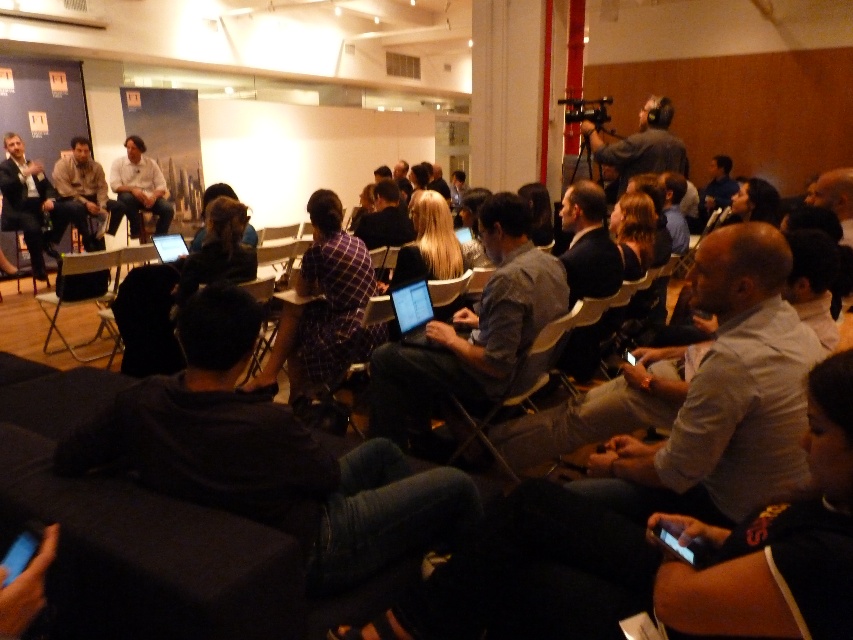
Is plaid fabric dress at center to the right of matte black suit at left from the viewer's perspective?

Yes, plaid fabric dress at center is to the right of matte black suit at left.

Is point (323, 227) farther from viewer compared to point (28, 230)?

No, (323, 227) is closer to viewer.

Where is `plaid fabric dress at center`? plaid fabric dress at center is located at coordinates (323, 307).

Which of these two, plaid fabric dress at center or black plastic chair at left, stands taller?

Standing taller between the two is plaid fabric dress at center.

Can you confirm if plaid fabric dress at center is thinner than black plastic chair at left?

Indeed, plaid fabric dress at center has a lesser width compared to black plastic chair at left.

The height and width of the screenshot is (640, 853). What do you see at coordinates (323, 307) in the screenshot?
I see `plaid fabric dress at center` at bounding box center [323, 307].

This screenshot has width=853, height=640. In order to click on plaid fabric dress at center in this screenshot , I will do `click(323, 307)`.

Which is below, plaid fabric dress at center or plaid fabric shirt at center?

plaid fabric dress at center is lower down.

What do you see at coordinates (323, 307) in the screenshot? The height and width of the screenshot is (640, 853). I see `plaid fabric dress at center` at bounding box center [323, 307].

This screenshot has height=640, width=853. Describe the element at coordinates (323, 307) in the screenshot. I see `plaid fabric dress at center` at that location.

This screenshot has width=853, height=640. I want to click on plaid fabric dress at center, so click(x=323, y=307).